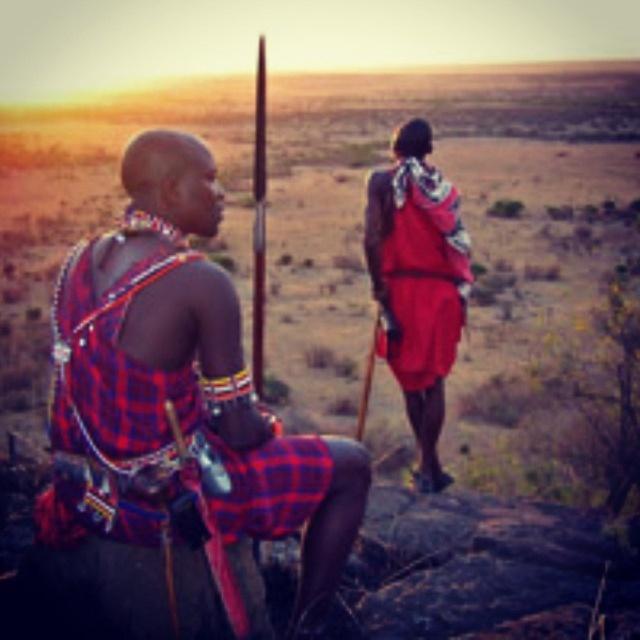
Which is above, plaid fabric shirt at left or red woven cloth at rear?

red woven cloth at rear is higher up.

Does plaid fabric shirt at left appear over red woven cloth at rear?

Actually, plaid fabric shirt at left is below red woven cloth at rear.

Which is in front, point (180, 541) or point (419, 288)?

Point (180, 541)

What are the coordinates of `plaid fabric shirt at left` in the screenshot? It's located at (176, 433).